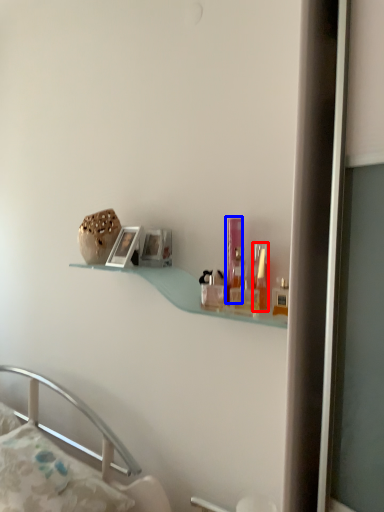
Question: Which of the following is the farthest to the observer, toiletry (highlighted by a red box) or toiletry (highlighted by a blue box)?

Choices:
 (A) toiletry
 (B) toiletry

Answer: (B)